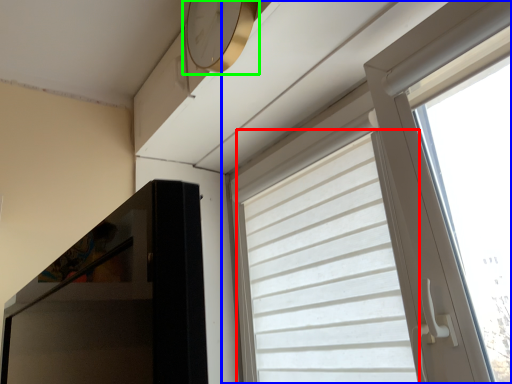
Question: Based on their relative distances, which object is farther from curtain (highlighted by a red box)? Choose from window (highlighted by a blue box) and clock (highlighted by a green box).

Choices:
 (A) window
 (B) clock

Answer: (B)